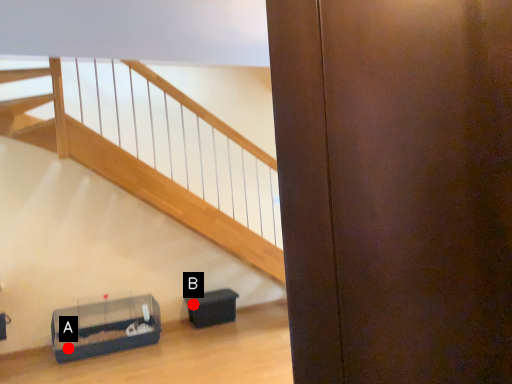
Question: Two points are circled on the image, labeled by A and B beside each circle. Which point is closer to the camera taking this photo?

Choices:
 (A) A is closer
 (B) B is closer

Answer: (A)